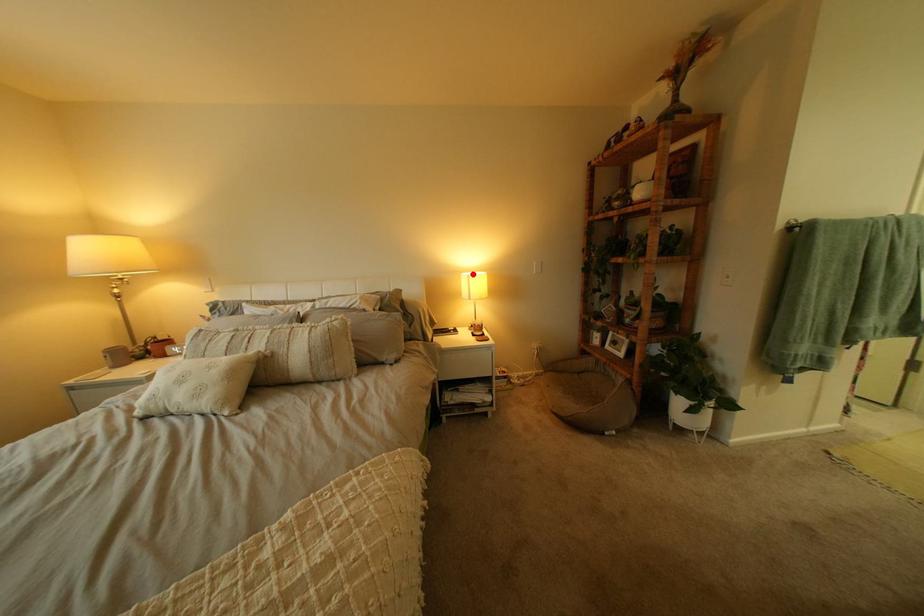
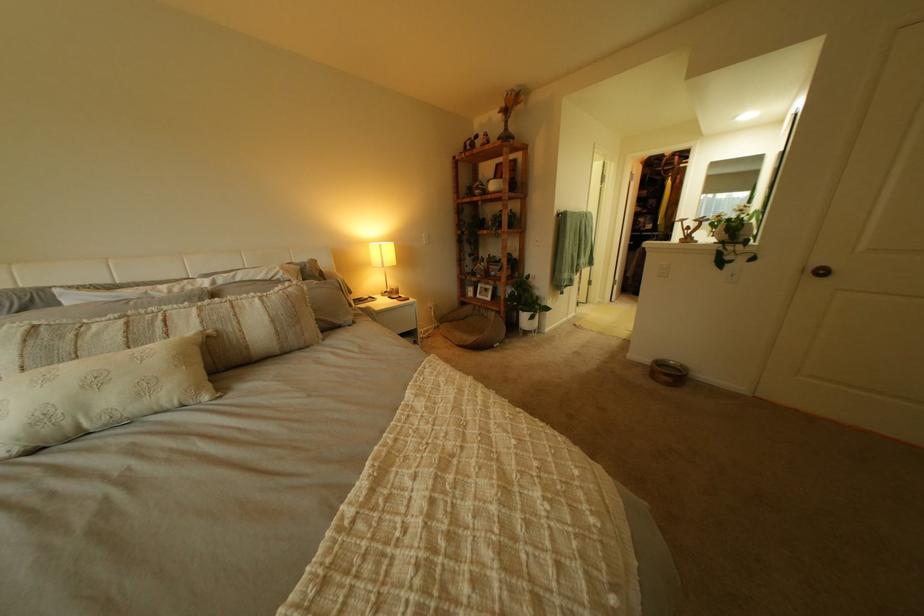
In the second image, find the point that corresponds to the highlighted location in the first image.

(381, 244)